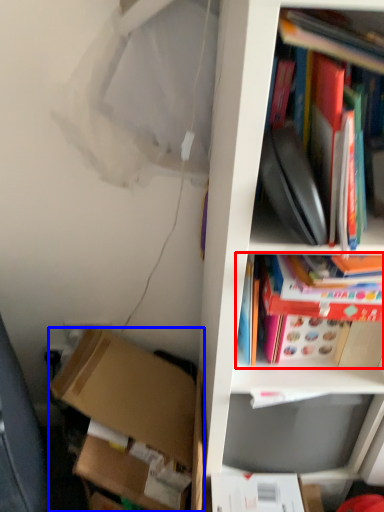
Question: Among these objects, which one is farthest to the camera, book (highlighted by a red box) or box (highlighted by a blue box)?

Choices:
 (A) book
 (B) box

Answer: (B)